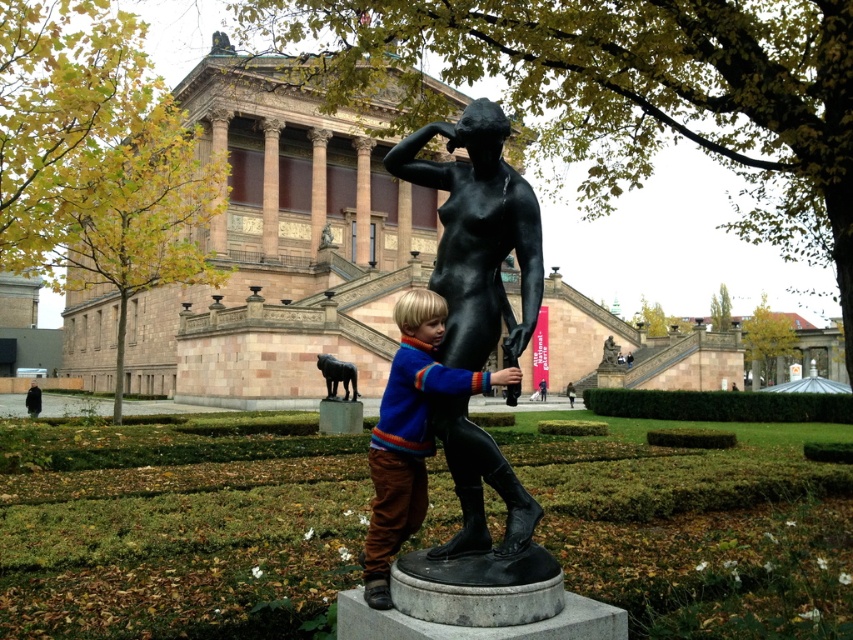
Question: Among these objects, which one is farthest from the camera?

Choices:
 (A) blue wool sweater at center
 (B) black marble statue at center

Answer: (A)

Question: Is black polished statue at center above blue wool sweater at center?

Choices:
 (A) no
 (B) yes

Answer: (A)

Question: Which object appears closest to the camera in this image?

Choices:
 (A) black polished statue at center
 (B) blue wool sweater at center

Answer: (A)

Question: Is black marble statue at center wider than black polished statue at center?

Choices:
 (A) yes
 (B) no

Answer: (A)

Question: Is black polished statue at center below blue wool sweater at center?

Choices:
 (A) yes
 (B) no

Answer: (A)

Question: Which point is closer to the camera?

Choices:
 (A) black polished statue at center
 (B) blue wool sweater at center

Answer: (A)